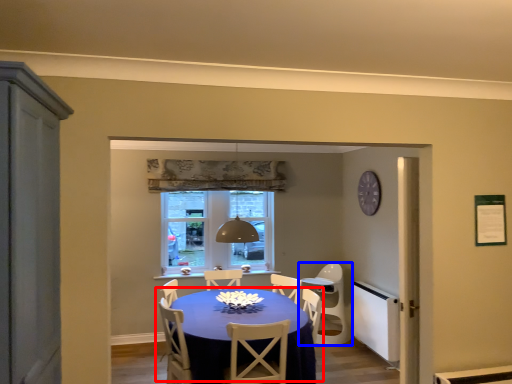
Question: Which of the following is the farthest to the observer, kitchen & dining room table (highlighted by a red box) or chair (highlighted by a blue box)?

Choices:
 (A) kitchen & dining room table
 (B) chair

Answer: (B)